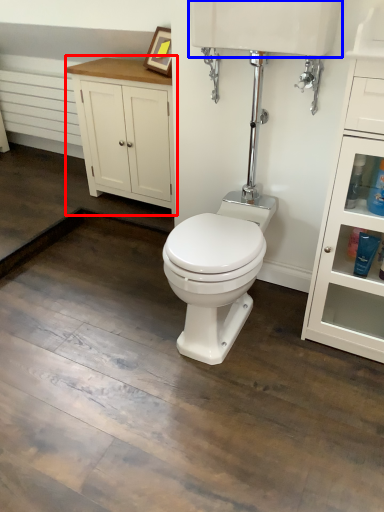
Question: Which point is closer to the camera, bathroom cabinet (highlighted by a red box) or sink (highlighted by a blue box)?

Choices:
 (A) bathroom cabinet
 (B) sink

Answer: (B)